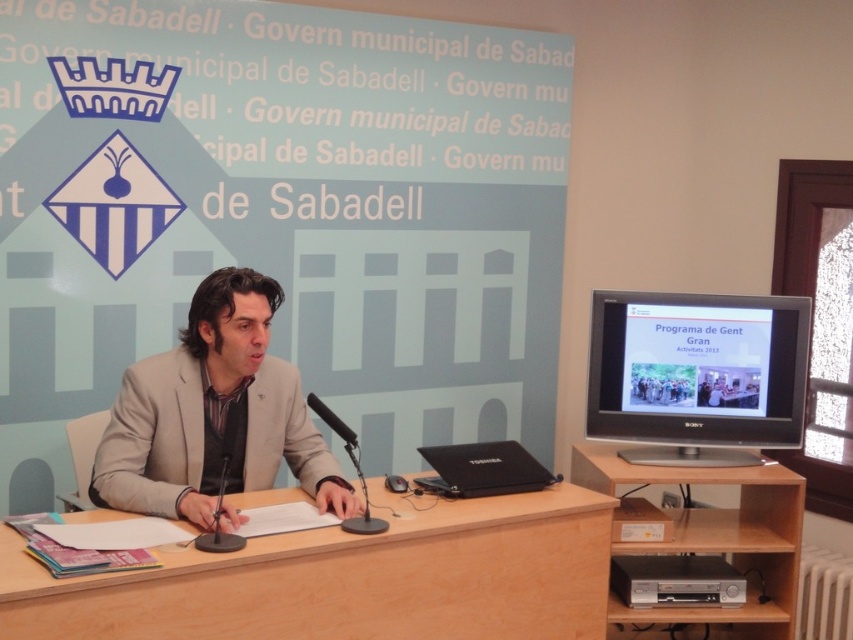
In the scene shown: Does wooden table at center have a larger size compared to matte black laptop at center?

Yes, wooden table at center is bigger than matte black laptop at center.

The height and width of the screenshot is (640, 853). I want to click on wooden table at center, so click(x=347, y=579).

Who is higher up, wooden table at center or black plastic microphone at center?

Positioned higher is black plastic microphone at center.

This screenshot has width=853, height=640. What do you see at coordinates (347, 579) in the screenshot?
I see `wooden table at center` at bounding box center [347, 579].

Which is behind, point (109, 611) or point (341, 433)?

The point (341, 433) is behind.

The image size is (853, 640). Identify the location of wooden table at center. (347, 579).

Can you confirm if beige fabric suit at center is smaller than matte black monitor at right?

No.

Between beige fabric suit at center and matte black monitor at right, which one appears on the left side from the viewer's perspective?

Positioned to the left is beige fabric suit at center.

What do you see at coordinates (213, 413) in the screenshot? I see `beige fabric suit at center` at bounding box center [213, 413].

Identify the location of beige fabric suit at center. (213, 413).